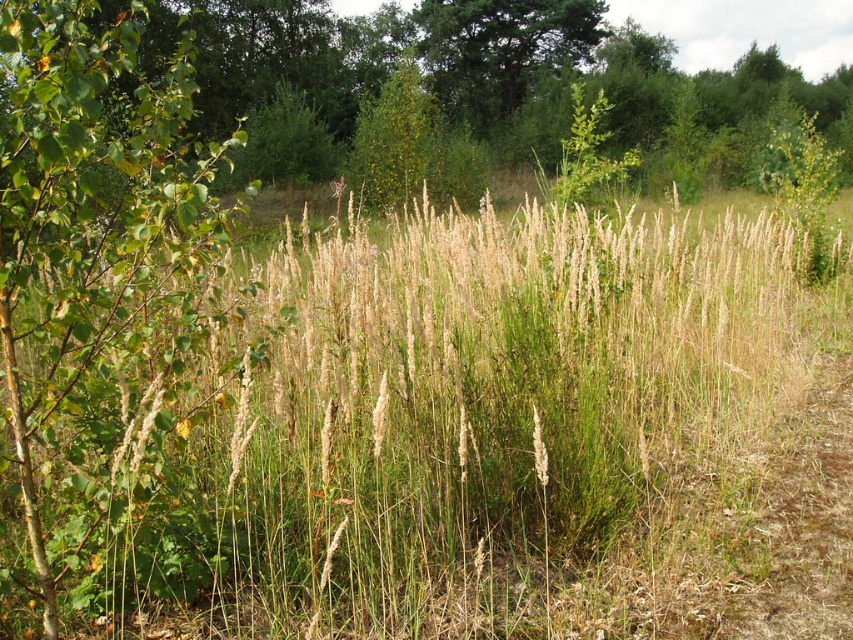
You are standing in the center of the field and want to walk towards the young tree on the left. Which direction should you walk to avoid the dry grass at center?

Since the dry grass at center is located at your current position, you should walk directly towards the young tree on the left to avoid it.

You are a gardener trying to decide which area to mow first. Based on the scene, which object has a narrower width between the dry grass at center and the green leafy tree at left?

The dry grass at center has a narrower width than the green leafy tree at left.

You are standing in the center of a field of tall grasses and wild plants. You notice a point marked at coordinates (480, 436). What type of vegetation is located at that point?

The point at coordinates (480, 436) corresponds to dry grass at center.